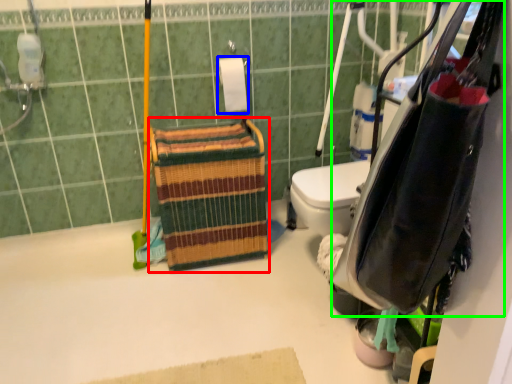
Question: Estimate the real-world distances between objects in this image. Which object is closer to basket (highlighted by a red box), toilet paper (highlighted by a blue box) or bag (highlighted by a green box)?

Choices:
 (A) toilet paper
 (B) bag

Answer: (A)